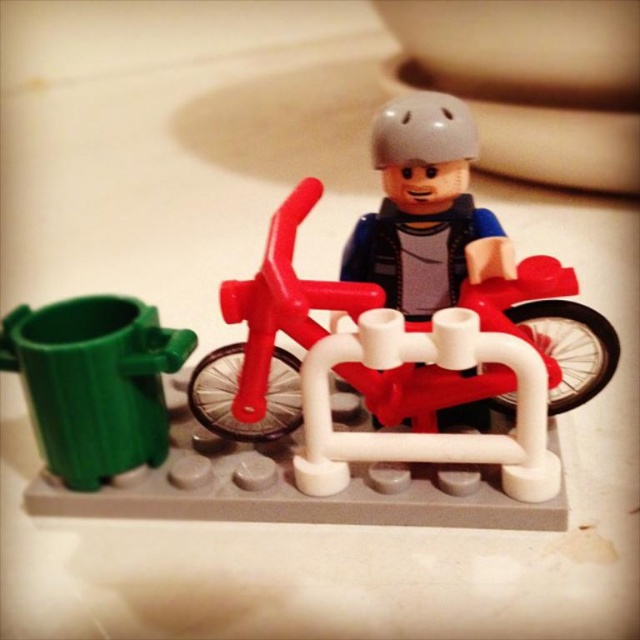
Based on the photo, you are a toy car collector who wants to move your matte red motorcycle at center closer to the green plastic trash can at left. The space between them is 19.49 centimeters. If your robotic arm can only move objects 15 centimeters, can it bridge the gap?

The distance between the matte red motorcycle at center and the green plastic trash can at left is 19.49 centimeters. Since the robotic arm can only move objects 15 centimeters, it cannot bridge the gap as the required distance is greater than its capability.

You are a LEGO enthusiast trying to fit a gray matte helmet at center onto the matte red motorcycle at center. Based on their sizes, will the helmet fit properly?

The matte red motorcycle at center has a larger size compared to the gray matte helmet at center, so the helmet should fit properly as it is smaller and likely designed to be placed on the motorcycle.

You are a parent trying to move a 30 inch long toy box from the corner to the center of the room. The toy box is currently next to the matte red motorcycle at center. Can you move it without tilting it sideways?

The toy box is 30 inches long, and the space between them is 29.46 inches. Since the space is slightly smaller than the toy box, you cannot move it without tilting it sideways.